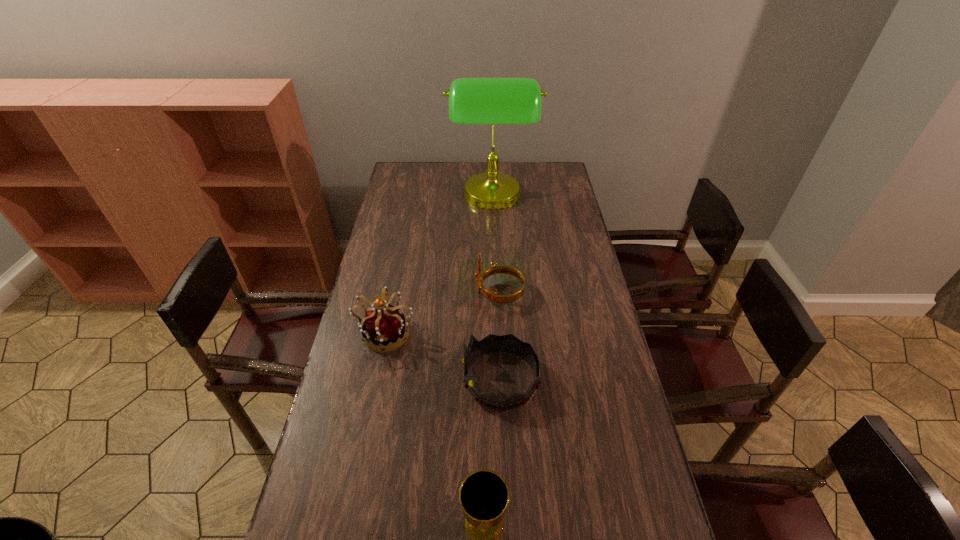
The width and height of the screenshot is (960, 540). I want to click on object that is the second closest to the lamp, so click(384, 326).

Locate which object ranks third in proximity to the chalice. Please provide its 2D coordinates. Your answer should be formatted as a tuple, i.e. [(x, y)], where the tuple contains the x and y coordinates of a point satisfying the conditions above.

[(492, 296)]

Identify which tiara is the closest to the farthest tiara. Please provide its 2D coordinates. Your answer should be formatted as a tuple, i.e. [(x, y)], where the tuple contains the x and y coordinates of a point satisfying the conditions above.

[(509, 343)]

Select which tiara is the second closest to the nearest object. Please provide its 2D coordinates. Your answer should be formatted as a tuple, i.e. [(x, y)], where the tuple contains the x and y coordinates of a point satisfying the conditions above.

[(384, 326)]

The image size is (960, 540). I want to click on blank area in the image that satisfies the following two spatial constraints: 1. on the front-facing side of the fourth nearest object; 2. on the front-facing side of the leftmost tiara, so click(x=501, y=332).

The width and height of the screenshot is (960, 540). Identify the location of free region that satisfies the following two spatial constraints: 1. on the desk next to the lamp; 2. on the front-facing side of the leftmost object. (497, 332).

What are the coordinates of `free space that satisfies the following two spatial constraints: 1. on the front-facing side of the fourth nearest object; 2. on the front-facing side of the leftmost tiara` in the screenshot? It's located at (501, 332).